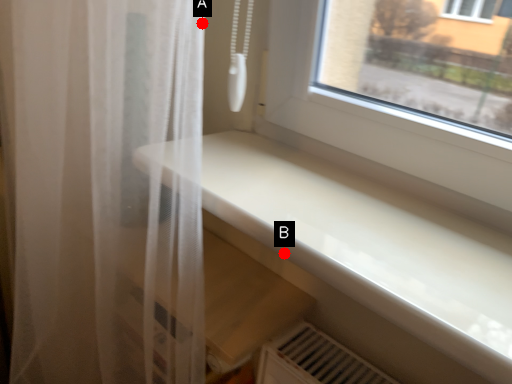
Question: Two points are circled on the image, labeled by A and B beside each circle. Among these points, which one is farthest from the camera?

Choices:
 (A) A is further
 (B) B is further

Answer: (A)